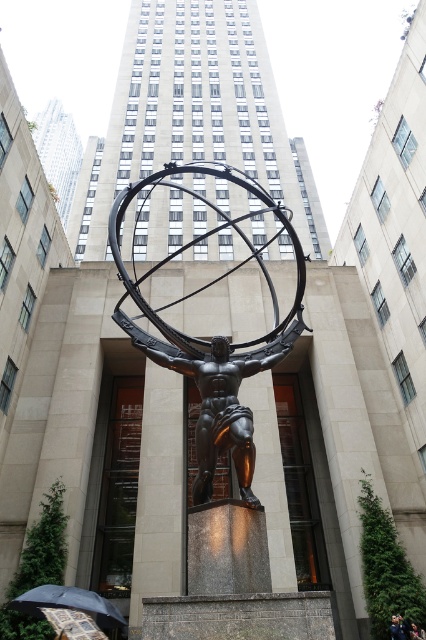
You are a photographer trying to capture the statue and its surroundings. You notice a dark blue fabric person at center and a dark blue jacket at lower right in your frame. Which object in your viewfinder is wider?

The dark blue jacket at lower right is wider than the dark blue fabric person at center.

You are a photographer standing in the plaza and want to capture both the shiny bronze statue at center and the dark blue jacket at lower right in the same frame. Can you position yourself so that the statue is visible above the jacket in the photo?

Yes, the shiny bronze statue at center is already positioned above the dark blue jacket at lower right, so by framing the shot to include both, the statue will naturally appear above the jacket in the photograph.

You are a photographer standing at the edge of the plaza. You want to take a photo of the shiny bronze statue at center and the dark blue jacket at lower right in the same frame. Based on their positions, which object should you focus on first to ensure both are in the frame?

The shiny bronze statue at center is to the left of the dark blue jacket at lower right, so you should focus on the shiny bronze statue at center first to ensure both are in the frame.